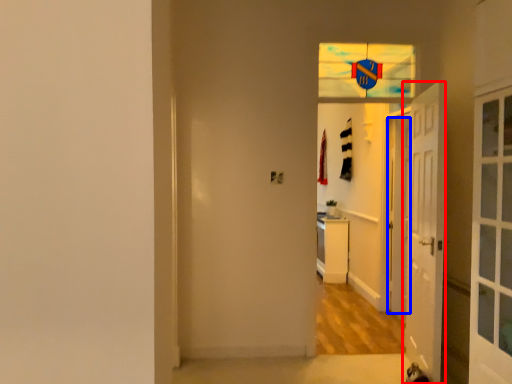
Question: Among these objects, which one is nearest to the camera, door (highlighted by a red box) or door (highlighted by a blue box)?

Choices:
 (A) door
 (B) door

Answer: (A)